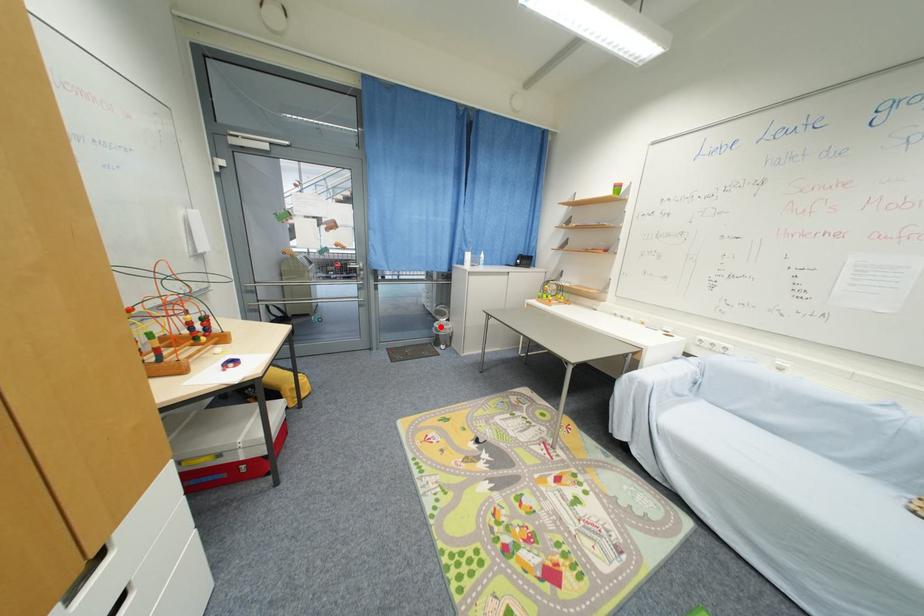
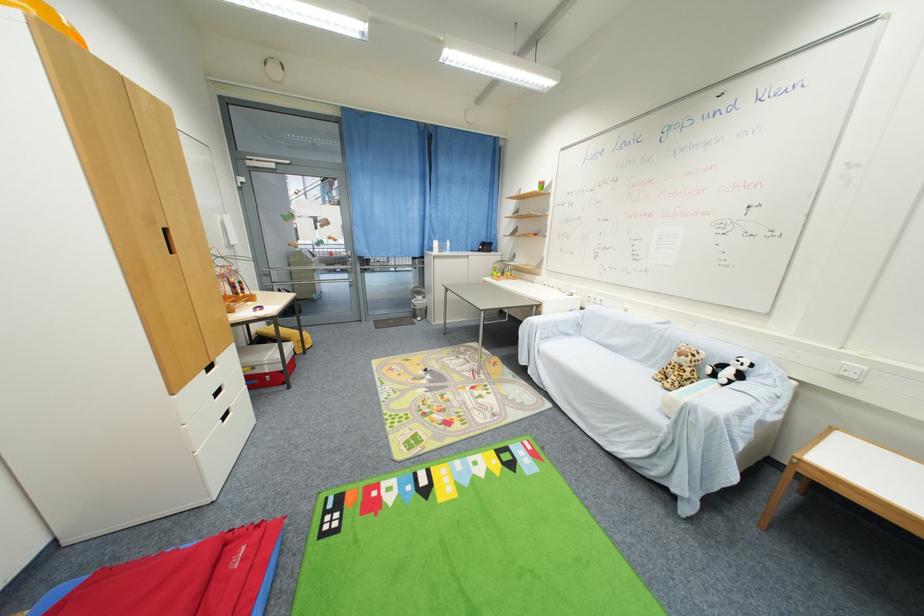
In the second image, find the point that corresponds to the highlighted location in the first image.

(418, 302)